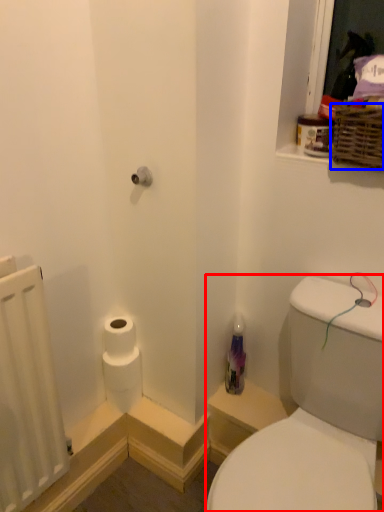
Question: Which point is further to the camera, sink (highlighted by a red box) or basket (highlighted by a blue box)?

Choices:
 (A) sink
 (B) basket

Answer: (B)